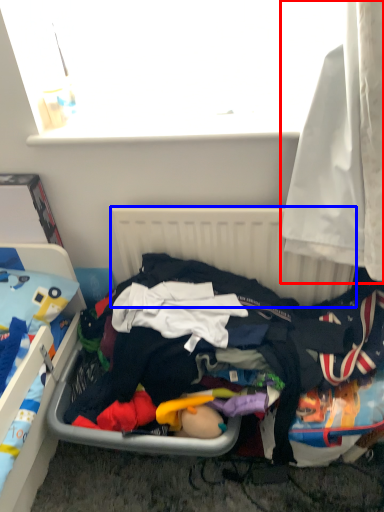
Question: Which object is closer to the camera taking this photo, curtain (highlighted by a red box) or radiator (highlighted by a blue box)?

Choices:
 (A) curtain
 (B) radiator

Answer: (A)